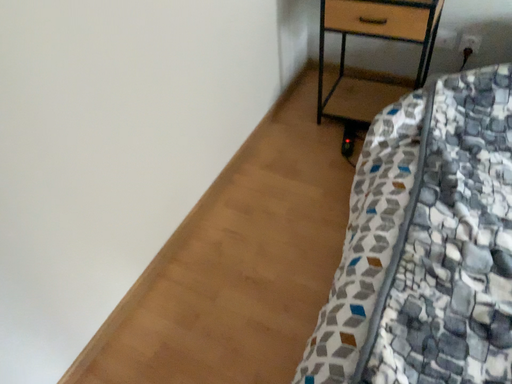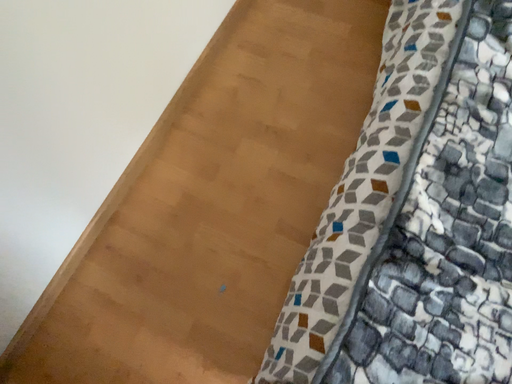
Question: Which way did the camera rotate in the video?

Choices:
 (A) rotated upward
 (B) rotated downward

Answer: (B)